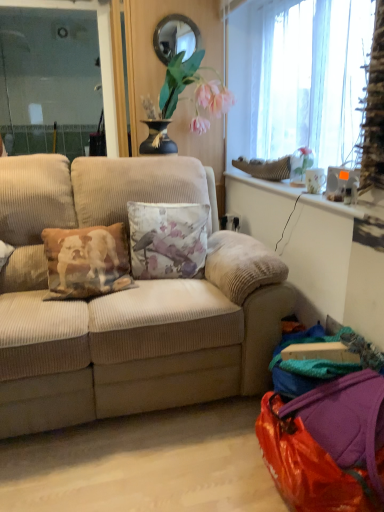
Image resolution: width=384 pixels, height=512 pixels. What do you see at coordinates (299, 78) in the screenshot?
I see `translucent fabric window at upper right` at bounding box center [299, 78].

I want to click on shiny orange bag at lower right, so click(326, 444).

Measure the distance between shiny orange bag at lower right and camera.

A distance of 1.18 meters exists between shiny orange bag at lower right and camera.

Image resolution: width=384 pixels, height=512 pixels. In order to click on beige corduroy couch at center in this screenshot , I will do `click(129, 346)`.

What do you see at coordinates (129, 346) in the screenshot?
I see `beige corduroy couch at center` at bounding box center [129, 346].

You are a GUI agent. You are given a task and a screenshot of the screen. Output one action in this format:
    pyautogui.click(x=<x>, y=<y>)
    Task: Click on the matte glass mirror at upper center
    The image size is (384, 512).
    Given the screenshot: What is the action you would take?
    pyautogui.click(x=175, y=37)

Locate an element on the screen. This screenshot has height=512, width=384. translucent fabric window at upper right is located at coordinates (299, 78).

Does beige corduroy couch at center turn towards translucent fabric window at upper right?

No.

Does beige corduroy couch at center appear on the left side of translucent fabric window at upper right?

Yes.

Is beige corduroy couch at center wider than translucent fabric window at upper right?

Yes.

Is beige corduroy couch at center not within translucent fabric window at upper right?

Yes, beige corduroy couch at center is located beyond the bounds of translucent fabric window at upper right.

Is translucent fabric window at upper right behind floral fabric cushion at center?

That is False.

Locate an element on the screen. This screenshot has width=384, height=512. pillow below the translucent fabric window at upper right (from a real-world perspective) is located at coordinates (167, 239).

In the scene shown: Which is closer to the camera, (360,24) or (175,226)?

Point (360,24) appears to be closer to the viewer than point (175,226).

Measure the distance between translucent fabric window at upper right and floral fabric cushion at center.

translucent fabric window at upper right is 34.26 inches from floral fabric cushion at center.

Which object is closer to the camera, translucent fabric window at upper right or shiny orange bag at lower right?

Positioned in front is shiny orange bag at lower right.

Would you say translucent fabric window at upper right contains shiny orange bag at lower right?

That's incorrect, shiny orange bag at lower right is not inside translucent fabric window at upper right.

Does point (300, 22) come in front of point (372, 500)?

No, (300, 22) is further to viewer.

Which of these two, translucent fabric window at upper right or shiny orange bag at lower right, is bigger?

translucent fabric window at upper right is bigger.

Is floral fabric cushion at center in front of or behind beige corduroy couch at center in the image?

floral fabric cushion at center is positioned farther from the viewer than beige corduroy couch at center.

Could you tell me if floral fabric cushion at center is turned towards beige corduroy couch at center?

Yes, floral fabric cushion at center faces towards beige corduroy couch at center.

Considering the sizes of objects floral fabric cushion at center and beige corduroy couch at center in the image provided, who is shorter, floral fabric cushion at center or beige corduroy couch at center?

floral fabric cushion at center is shorter.

Is point (194, 251) closer or farther from the camera than point (159, 180)?

Point (194, 251).

Is matte glass mirror at upper center smaller than translucent fabric window at upper right?

Indeed, matte glass mirror at upper center has a smaller size compared to translucent fabric window at upper right.

I want to click on window in front of the matte glass mirror at upper center, so click(299, 78).

In the image, is matte glass mirror at upper center positioned in front of or behind translucent fabric window at upper right?

Clearly, matte glass mirror at upper center is behind translucent fabric window at upper right.

Would you say matte glass mirror at upper center is a long distance from beige corduroy couch at center?

matte glass mirror at upper center is positioned a significant distance from beige corduroy couch at center.

Consider the image. Which of these two, matte glass mirror at upper center or beige corduroy couch at center, is wider?

Wider between the two is beige corduroy couch at center.

Considering the relative positions of matte glass mirror at upper center and beige corduroy couch at center in the image provided, is matte glass mirror at upper center to the right of beige corduroy couch at center from the viewer's perspective?

Yes.

Between matte glass mirror at upper center and beige corduroy couch at center, which one has smaller size?

matte glass mirror at upper center.

From the image's perspective, is floral fabric cushion at center over shiny orange bag at lower right?

Yes, from the image's perspective, floral fabric cushion at center is on top of shiny orange bag at lower right.

Locate an element on the screen. The image size is (384, 512). bag located on the right of floral fabric cushion at center is located at coordinates (326, 444).

In the scene shown: Which of these two, floral fabric cushion at center or shiny orange bag at lower right, is wider?

shiny orange bag at lower right.

Is floral fabric cushion at center touching shiny orange bag at lower right?

No, floral fabric cushion at center is not making contact with shiny orange bag at lower right.

Image resolution: width=384 pixels, height=512 pixels. In order to click on studio couch on the left side of translucent fabric window at upper right in this screenshot , I will do `click(129, 346)`.

What are the coordinates of `window located above the floral fabric cushion at center (from the image's perspective)` in the screenshot? It's located at coord(299,78).

From the image, which object appears to be farther from floral fabric cushion at center, matte glass mirror at upper center or translucent fabric window at upper right?

matte glass mirror at upper center is further to floral fabric cushion at center.

When comparing their distances from matte glass mirror at upper center, does translucent fabric window at upper right or beige corduroy couch at center seem closer?

translucent fabric window at upper right lies closer to matte glass mirror at upper center than the other object.

When comparing their distances from shiny orange bag at lower right, does floral fabric cushion at center or matte glass mirror at upper center seem closer?

The object closer to shiny orange bag at lower right is floral fabric cushion at center.

When comparing their distances from floral fabric cushion at center, does shiny orange bag at lower right or matte glass mirror at upper center seem closer?

The object closer to floral fabric cushion at center is shiny orange bag at lower right.

Estimate the real-world distances between objects in this image. Which object is further from beige corduroy couch at center, shiny orange bag at lower right or translucent fabric window at upper right?

translucent fabric window at upper right is further to beige corduroy couch at center.

Which object lies nearer to the anchor point translucent fabric window at upper right, beige corduroy couch at center or shiny orange bag at lower right?

The object closer to translucent fabric window at upper right is beige corduroy couch at center.

Considering their positions, is shiny orange bag at lower right positioned closer to matte glass mirror at upper center than beige corduroy couch at center?

The object closer to matte glass mirror at upper center is beige corduroy couch at center.

Which object lies further to the anchor point floral fabric cushion at center, translucent fabric window at upper right or beige corduroy couch at center?

translucent fabric window at upper right lies further to floral fabric cushion at center than the other object.

Find the location of a particular element. pillow between matte glass mirror at upper center and beige corduroy couch at center in the vertical direction is located at coordinates (167, 239).

The height and width of the screenshot is (512, 384). What are the coordinates of `window between matte glass mirror at upper center and shiny orange bag at lower right from top to bottom` in the screenshot? It's located at 299,78.

Find the location of a particular element. The width and height of the screenshot is (384, 512). pillow between translucent fabric window at upper right and shiny orange bag at lower right in the vertical direction is located at coordinates (167, 239).

Where is `pillow between translucent fabric window at upper right and beige corduroy couch at center vertically`? The height and width of the screenshot is (512, 384). pillow between translucent fabric window at upper right and beige corduroy couch at center vertically is located at coordinates (167, 239).